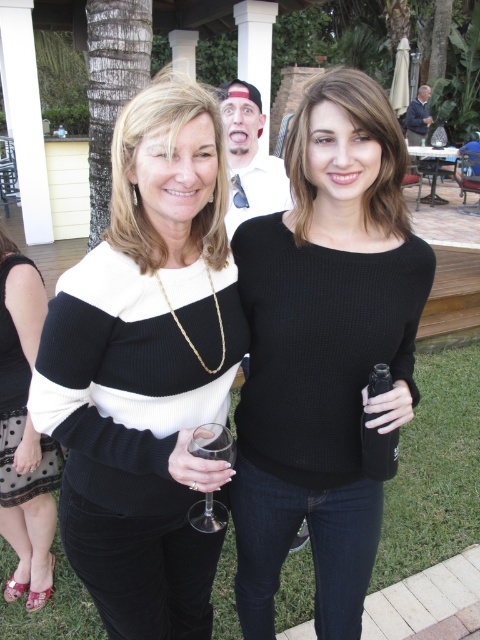
You are standing at the point labeled as point (175, 513) in the image. If you want to walk towards the viewer, which direction should you move?

Since point (175, 513) is 4.30 feet away from the viewer, moving towards the viewer would mean walking in the direction towards the viewer from that point.

You are a photographer adjusting your camera settings to capture the scene. You need to focus on the black textured sweater at center and the clear glass wine glass at lower center. Which object should you adjust your focus to first if you want to ensure both are in focus, considering their sizes?

The black textured sweater at center has a greater height compared to the clear glass wine glass at lower center, so you should focus on the larger object first to ensure both are in focus.